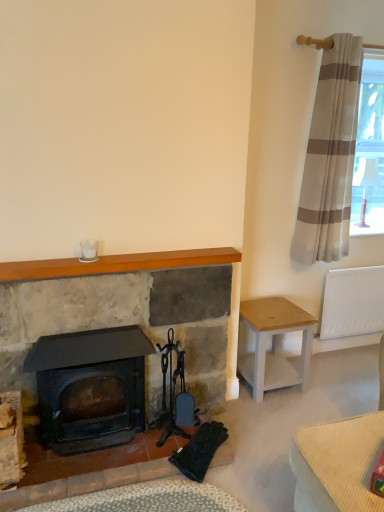
Question: From the image's perspective, is white fabric lampshade at upper right beneath wooden mantle at upper center?

Choices:
 (A) yes
 (B) no

Answer: (B)

Question: Considering the relative sizes of white fabric lampshade at upper right and wooden mantle at upper center in the image provided, is white fabric lampshade at upper right wider than wooden mantle at upper center?

Choices:
 (A) no
 (B) yes

Answer: (B)

Question: Can you confirm if white fabric lampshade at upper right is smaller than wooden mantle at upper center?

Choices:
 (A) no
 (B) yes

Answer: (A)

Question: Is white fabric lampshade at upper right touching wooden mantle at upper center?

Choices:
 (A) yes
 (B) no

Answer: (B)

Question: From a real-world perspective, is white fabric lampshade at upper right located beneath wooden mantle at upper center?

Choices:
 (A) yes
 (B) no

Answer: (B)

Question: In terms of height, does matte stone fireplace at center look taller or shorter compared to white wood stool at right?

Choices:
 (A) short
 (B) tall

Answer: (B)

Question: Would you say matte stone fireplace at center is inside or outside white wood stool at right?

Choices:
 (A) outside
 (B) inside

Answer: (A)

Question: In the image, is matte stone fireplace at center positioned in front of or behind white wood stool at right?

Choices:
 (A) behind
 (B) front

Answer: (B)

Question: From a real-world perspective, is matte stone fireplace at center physically located above or below white wood stool at right?

Choices:
 (A) below
 (B) above

Answer: (B)

Question: Considering the positions of white plastic radiator at right and beige striped curtain at upper right in the image, is white plastic radiator at right wider or thinner than beige striped curtain at upper right?

Choices:
 (A) thin
 (B) wide

Answer: (A)

Question: Is white plastic radiator at right taller or shorter than beige striped curtain at upper right?

Choices:
 (A) short
 (B) tall

Answer: (A)

Question: Considering the positions of white plastic radiator at right and beige striped curtain at upper right in the image, is white plastic radiator at right bigger or smaller than beige striped curtain at upper right?

Choices:
 (A) big
 (B) small

Answer: (B)

Question: Is point click(374, 326) closer or farther from the camera than point click(357, 39)?

Choices:
 (A) farther
 (B) closer

Answer: (A)

Question: From the image's perspective, is wooden mantle at upper center above or below white wood stool at right?

Choices:
 (A) above
 (B) below

Answer: (A)

Question: In terms of size, does wooden mantle at upper center appear bigger or smaller than white wood stool at right?

Choices:
 (A) big
 (B) small

Answer: (B)